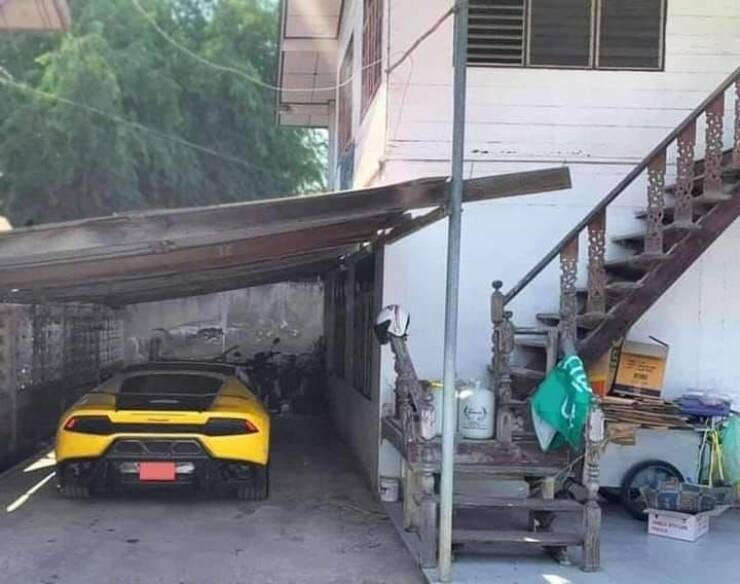
The width and height of the screenshot is (740, 584). Identify the location of open cardboard box. (644, 357), (670, 529).